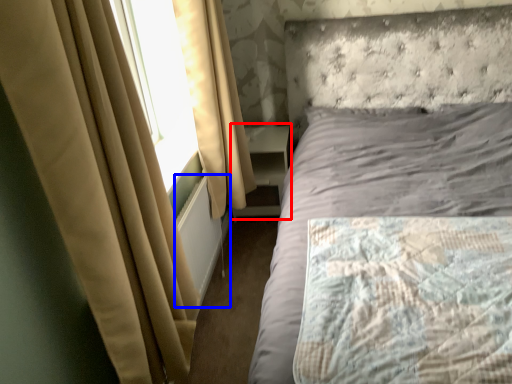
Question: Among these objects, which one is farthest to the camera, bookshelf (highlighted by a red box) or radiator (highlighted by a blue box)?

Choices:
 (A) bookshelf
 (B) radiator

Answer: (A)